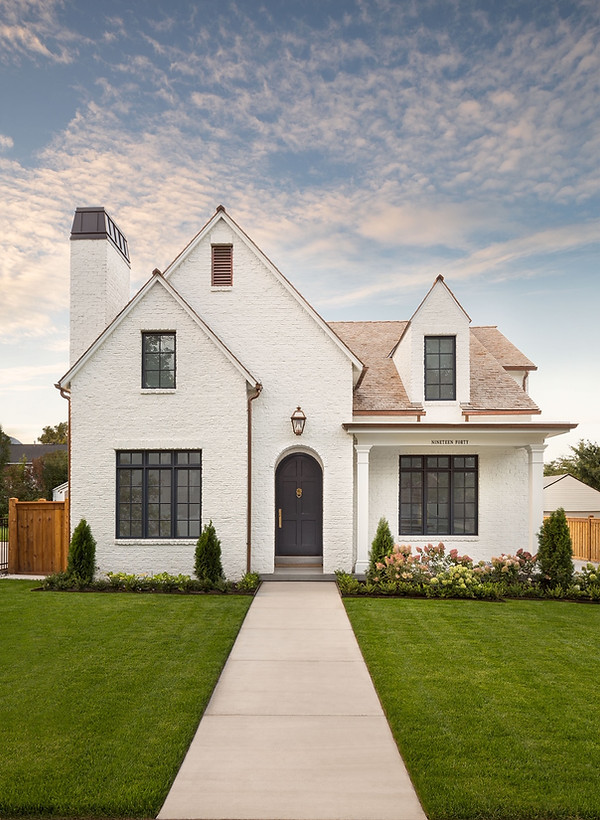
The height and width of the screenshot is (820, 600). Identify the location of front door. (300, 526).